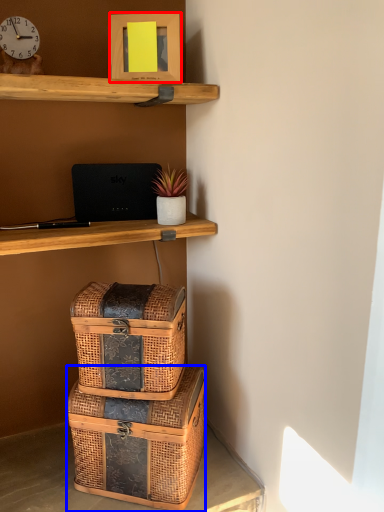
Question: Which object is closer to the camera taking this photo, picture frame (highlighted by a red box) or box (highlighted by a blue box)?

Choices:
 (A) picture frame
 (B) box

Answer: (B)